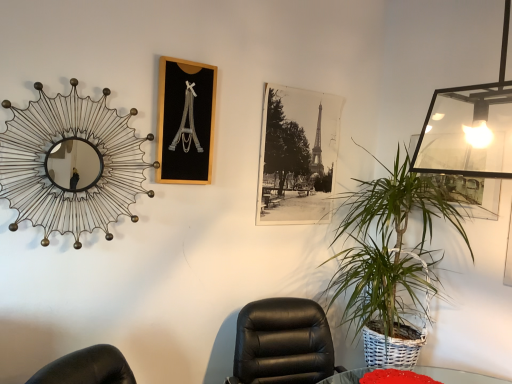
Question: From their relative heights in the image, would you say metallic wire mirror at upper left is taller or shorter than black wood picture frame at upper center, the 1th picture frame when ordered from left to right?

Choices:
 (A) tall
 (B) short

Answer: (A)

Question: In the image, is metallic wire mirror at upper left on the left side or the right side of black wood picture frame at upper center, the 2th picture frame viewed from the back?

Choices:
 (A) right
 (B) left

Answer: (B)

Question: Which object is positioned farthest from the metallic wire mirror at upper left?

Choices:
 (A) black leather chair at center
 (B) green woven basket at right
 (C) black paper photo at center, marked as the 2th picture frame in a left-to-right arrangement
 (D) black wood picture frame at upper center, the 1th picture frame when ordered from left to right

Answer: (B)

Question: Which of these objects is positioned farthest from the black paper photo at center, placed as the second picture frame when sorted from front to back?

Choices:
 (A) metallic wire mirror at upper left
 (B) green woven basket at right
 (C) black wood picture frame at upper center, the 1th picture frame when ordered from left to right
 (D) black leather chair at center

Answer: (A)